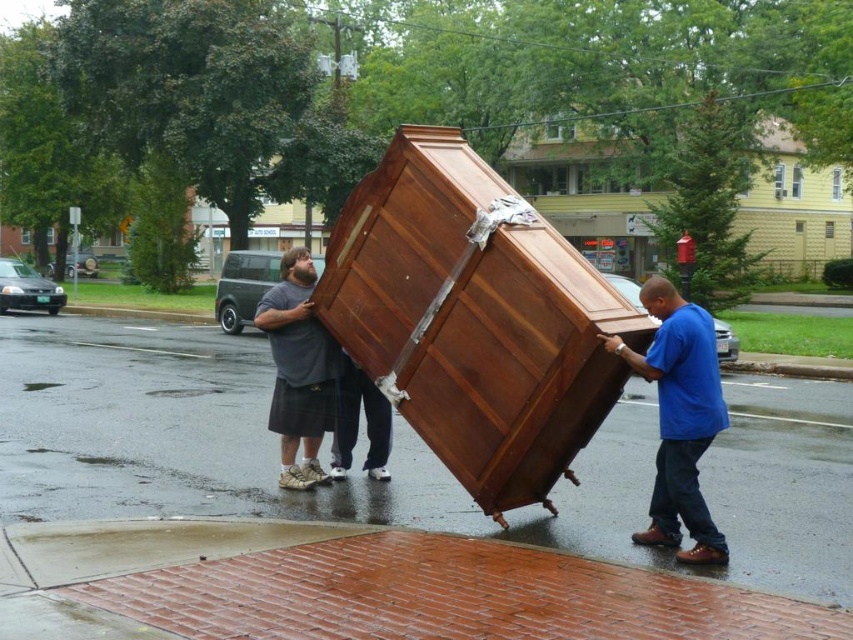
You are standing on the wet street and see the point at coordinates (682, 484). If you want to place a 2 meter long ladder from your current position to that point, will it reach?

The point at coordinates (682, 484) is 6.74 meters away from the viewer. Since the ladder is only 2 meters long, it will not reach that point.

You are a photographer trying to capture both the blue cotton shirt at right and the gray cotton shirt at center in a single frame. Since the camera has a limited focus range, which shirt should you focus on first to ensure it appears clearer in the photo?

The blue cotton shirt at right is larger in size than the gray cotton shirt at center, so focusing on the blue cotton shirt at right first will ensure it is clearer because larger objects require more focus attention.

You are standing at the point labeled point (x=674, y=300) and want to move towards the point labeled point (x=306, y=269). Given that the path between them is 1.2 meters wide, can a delivery robot with a width of 0.9 meters pass through this path?

The path between point (x=674, y=300) and point (x=306, y=269) is 1.2 meters wide. Since the delivery robot is only 0.9 meters wide, it can pass through the path as it is wider than the robot.